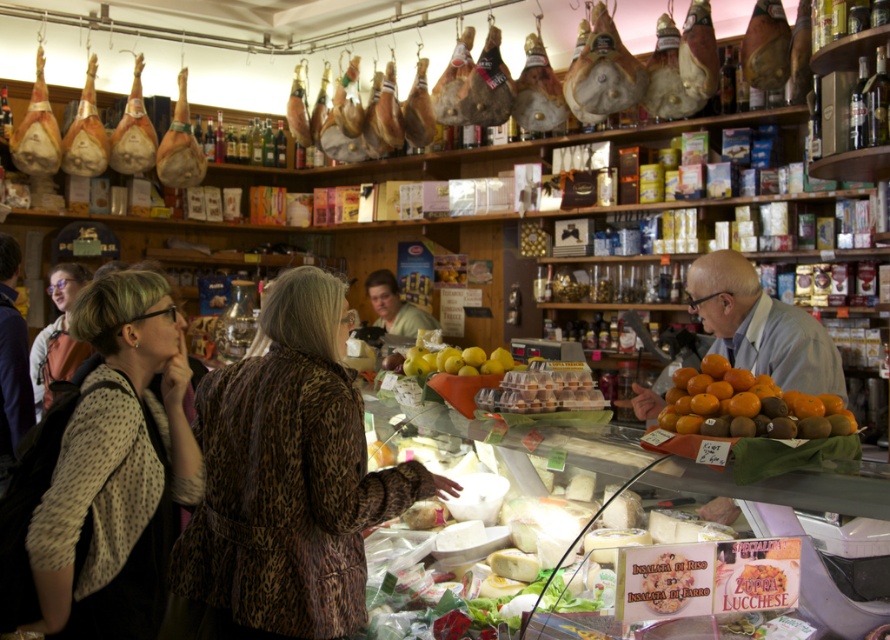
Question: Is patterned fabric jacket at center to the left of orange matte at center from the viewer's perspective?

Choices:
 (A) no
 (B) yes

Answer: (B)

Question: Which object is farther from the camera taking this photo?

Choices:
 (A) leopard print coat at center
 (B) yellow matte lemons at center
 (C) patterned fabric jacket at center

Answer: (B)

Question: Can you confirm if matte black jacket at left is wider than yellow matte lemons at center?

Choices:
 (A) no
 (B) yes

Answer: (A)

Question: Does leopard print coat at center have a greater width compared to matte black jacket at left?

Choices:
 (A) no
 (B) yes

Answer: (B)

Question: Which object is the farthest from the orange matte at center?

Choices:
 (A) matte black jacket at left
 (B) patterned fabric jacket at center
 (C) yellow matte lemons at center
 (D) leopard print coat at center

Answer: (A)

Question: Estimate the real-world distances between objects in this image. Which object is farther from the orange matte at center?

Choices:
 (A) leopard print coat at center
 (B) yellow matte lemons at center
 (C) patterned fabric jacket at center
 (D) matte black jacket at left

Answer: (D)